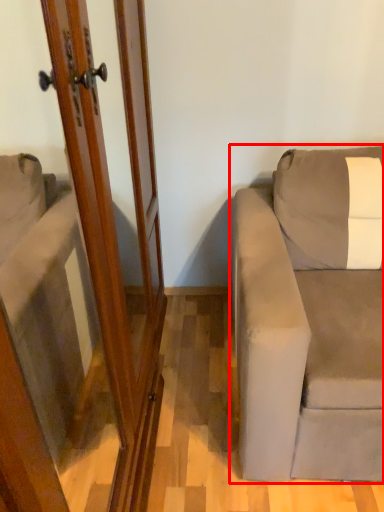
Question: Where is studio couch (annotated by the red box) located in relation to screen door in the image?

Choices:
 (A) left
 (B) right

Answer: (B)